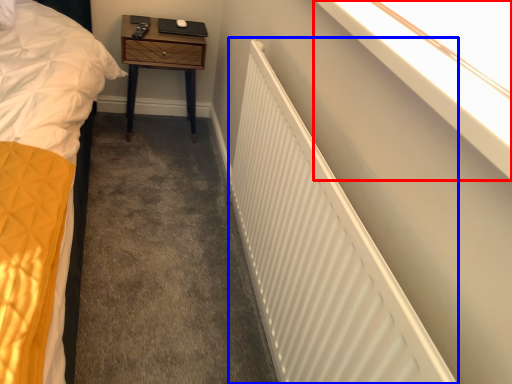
Question: Which object appears farthest to the camera in this image, window sill (highlighted by a red box) or radiator (highlighted by a blue box)?

Choices:
 (A) window sill
 (B) radiator

Answer: (B)